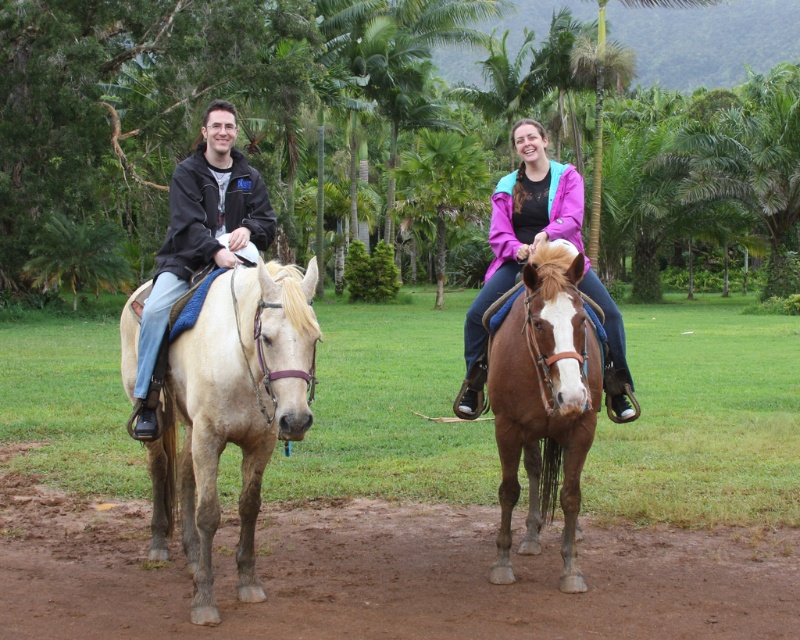
Question: In this image, where is brown dirt track at lower center located relative to matte black jacket at left?

Choices:
 (A) below
 (B) above

Answer: (A)

Question: Which point appears farthest from the camera in this image?

Choices:
 (A) (236, 182)
 (B) (22, 634)

Answer: (A)

Question: Can you confirm if brown leather horse at center is thinner than matte purple jacket at center?

Choices:
 (A) no
 (B) yes

Answer: (B)

Question: Which object appears closest to the camera in this image?

Choices:
 (A) matte purple jacket at center
 (B) matte black jacket at left

Answer: (A)

Question: Estimate the real-world distances between objects in this image. Which object is farther from the brown dirt track at lower center?

Choices:
 (A) matte purple jacket at center
 (B) brown leather horse at center

Answer: (A)

Question: Is brown dirt track at lower center wider than matte purple jacket at center?

Choices:
 (A) no
 (B) yes

Answer: (B)